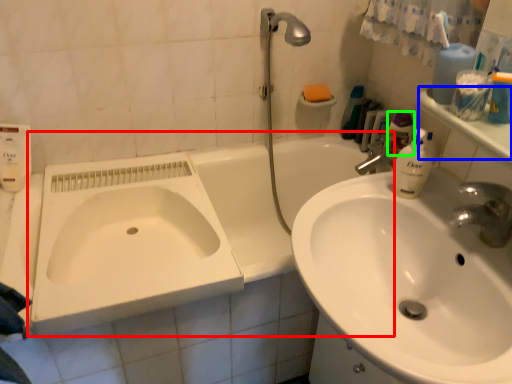
Question: Which is nearer to the bath (highlighted by a red box)? counter top (highlighted by a blue box) or toiletry (highlighted by a green box).

Choices:
 (A) counter top
 (B) toiletry

Answer: (B)